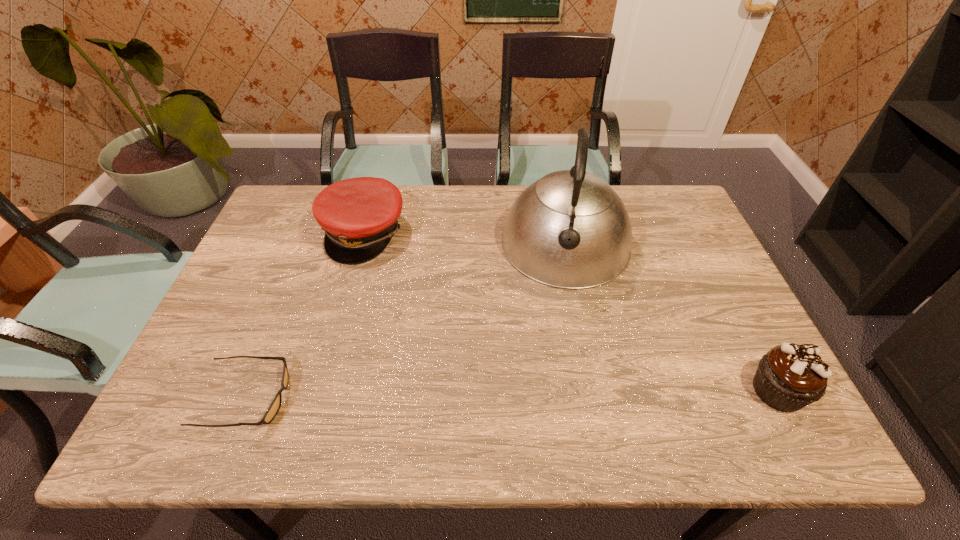
Locate an element on the screen. Image resolution: width=960 pixels, height=540 pixels. sunglasses is located at coordinates (274, 407).

Find the location of `the rightmost object`. the rightmost object is located at coordinates (789, 377).

Identify the location of kettle. Image resolution: width=960 pixels, height=540 pixels. (570, 229).

Identify the location of the third object from left to right. (570, 229).

You are a GUI agent. You are given a task and a screenshot of the screen. Output one action in this format:
    pyautogui.click(x=<x>, y=<y>)
    Task: Click on the cap
    This screenshot has height=540, width=960.
    Given the screenshot: What is the action you would take?
    pyautogui.click(x=359, y=215)

What are the coordinates of `blank space located on the front-facing side of the shortest object` in the screenshot? It's located at (348, 397).

Where is `free space located on the left of the rightmost object`? free space located on the left of the rightmost object is located at coordinates click(x=617, y=391).

This screenshot has height=540, width=960. I want to click on free point located 0.280m from the spout of the kettle, so click(x=552, y=384).

Find the location of a particular element. The height and width of the screenshot is (540, 960). vacant area situated 0.310m from the spout of the kettle is located at coordinates (550, 396).

This screenshot has height=540, width=960. Find the location of `vacant space located from the spout of the kettle`. vacant space located from the spout of the kettle is located at coordinates (557, 335).